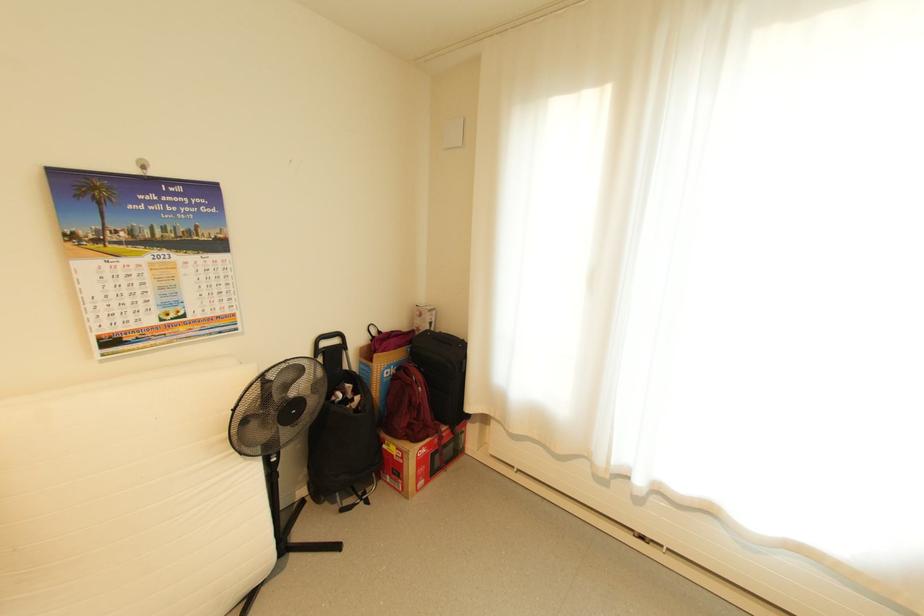
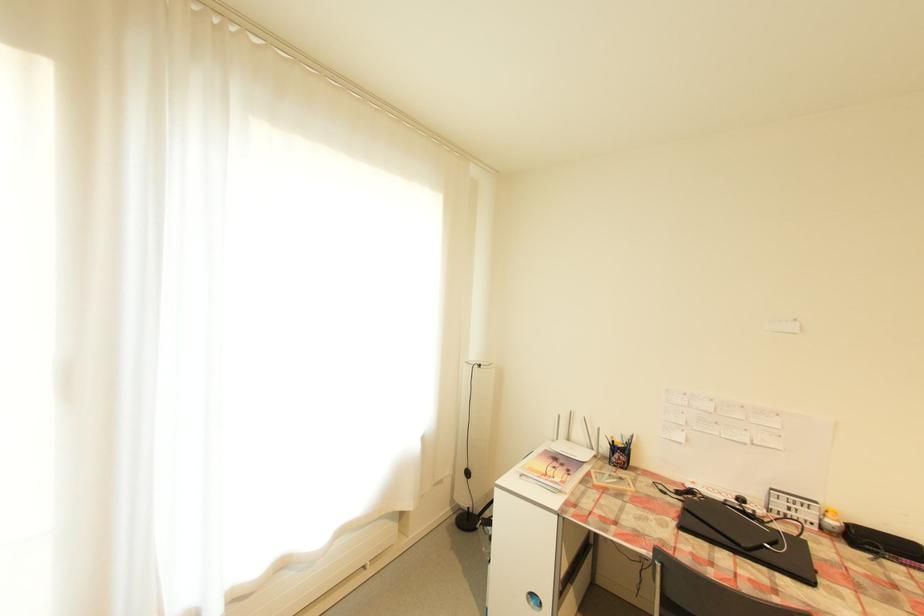
Question: Based on the continuous images, in which direction is the camera rotating? Reply with the corresponding letter.

Choices:
 (A) Left
 (B) Right
 (C) Up
 (D) Down

Answer: (B)